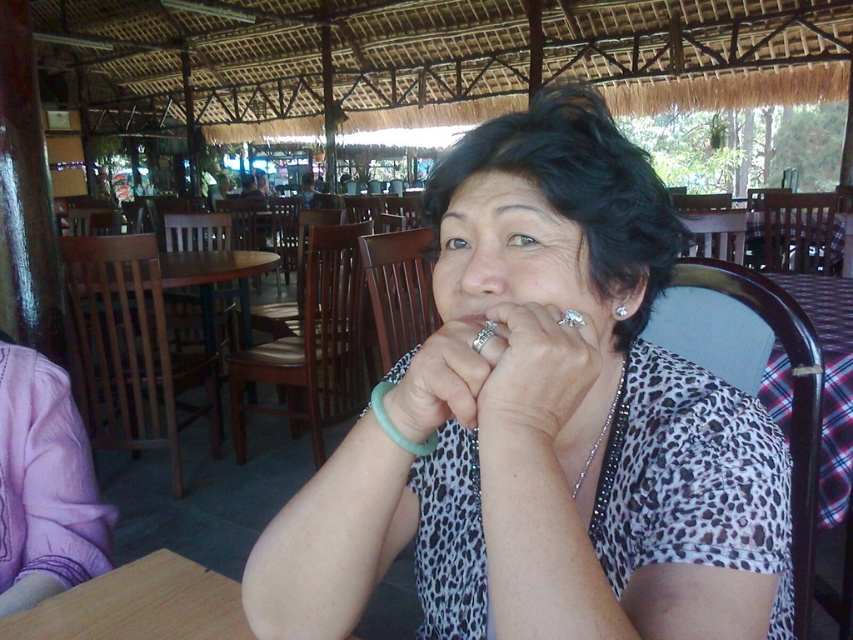
Question: Among these points, which one is farthest from the camera?

Choices:
 (A) (585, 324)
 (B) (386, 394)
 (C) (430, 449)

Answer: (C)

Question: Where is brown wooden table at center located in relation to teal rubber bracelet at lower center in the image?

Choices:
 (A) right
 (B) left

Answer: (B)

Question: Which point is closer to the camera?

Choices:
 (A) (413, 454)
 (B) (555, 330)
 (C) (202, 310)

Answer: (B)

Question: Can you confirm if brown wooden table at center is positioned to the right of teal rubber bracelet at lower center?

Choices:
 (A) no
 (B) yes

Answer: (A)

Question: Is leopard print blouse at center wider than silver metallic ring at center?

Choices:
 (A) no
 (B) yes

Answer: (B)

Question: Which of the following is the closest to the observer?

Choices:
 (A) brown wooden table at center
 (B) silver metallic ring at center
 (C) leopard print shirt at center
 (D) leopard print blouse at center

Answer: (D)